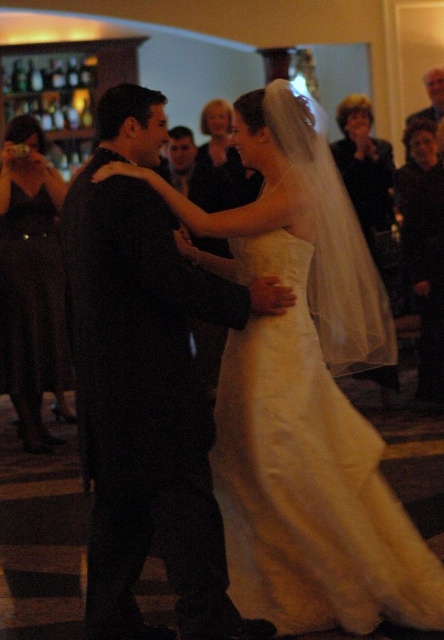
You are a photographer at the wedding reception. You need to take a photo of the satin dress at center and dark brown leather jacket at center. Which object should you focus on first if you want to capture both in the same frame without moving the camera?

The satin dress at center is much taller than the dark brown leather jacket at center, so you should focus on the satin dress at center first to ensure it is in frame before adjusting for the jacket.

You are a photographer at the wedding reception. You need to capture a photo of the matte black dress at left and dark brown leather jacket at center. Which object should you focus on first if you want to ensure both are in focus without adjusting the camera settings?

The matte black dress at left is much taller than the dark brown leather jacket at center. Therefore, focusing on the matte black dress at left first will ensure both are in focus since it is farther away and the depth of field will cover the closer object.